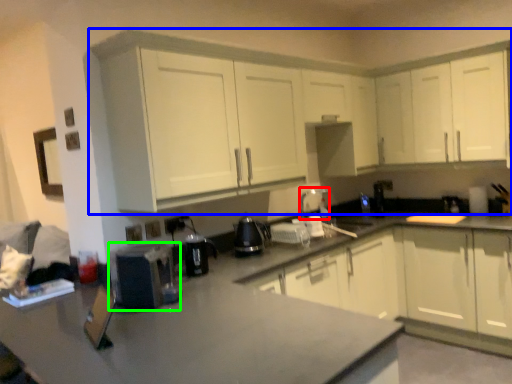
Question: Which object is positioned closest to appliance (highlighted by a red box)? Select from cabinetry (highlighted by a blue box) and appliance (highlighted by a green box).

Choices:
 (A) cabinetry
 (B) appliance

Answer: (A)